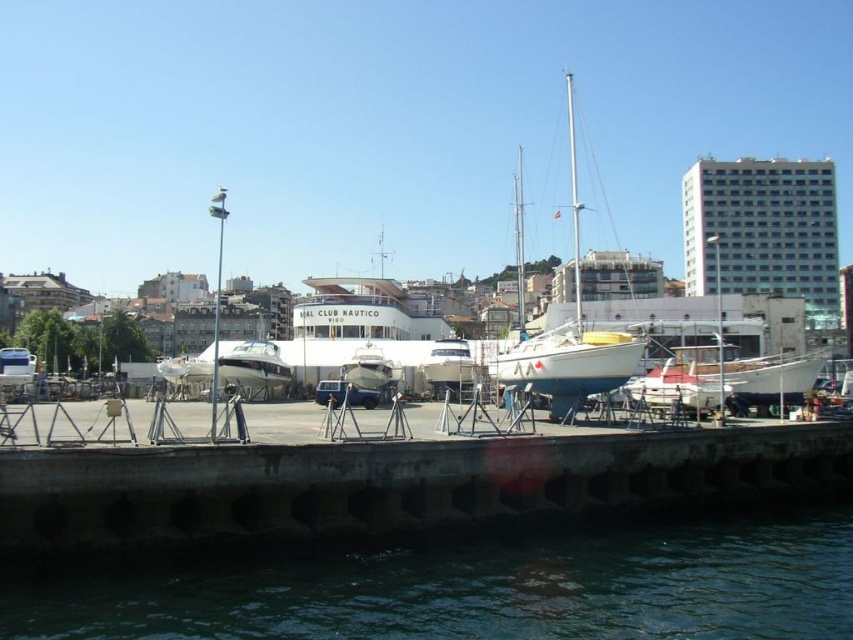
Can you confirm if greenish water at lower center is positioned below white glossy boat at center?

Yes.

Is point (561, 532) closer to viewer compared to point (187, 358)?

Yes, it is.

The height and width of the screenshot is (640, 853). What are the coordinates of `greenish water at lower center` in the screenshot? It's located at (469, 586).

How far apart are white matte sailboat at center and white glossy boat at center?

50.66 meters

Who is positioned more to the right, white matte sailboat at center or white glossy boat at center?

Positioned to the right is white matte sailboat at center.

I want to click on white matte sailboat at center, so click(x=570, y=337).

Locate an element on the screen. The height and width of the screenshot is (640, 853). white matte sailboat at center is located at coordinates (570, 337).

Is greenish water at lower center behind white matte sailboat at center?

No, it is in front of white matte sailboat at center.

What do you see at coordinates (469, 586) in the screenshot? This screenshot has height=640, width=853. I see `greenish water at lower center` at bounding box center [469, 586].

Between point (357, 563) and point (598, 348), which one is positioned behind?

The point (598, 348) is behind.

Where is `greenish water at lower center`? Image resolution: width=853 pixels, height=640 pixels. greenish water at lower center is located at coordinates coord(469,586).